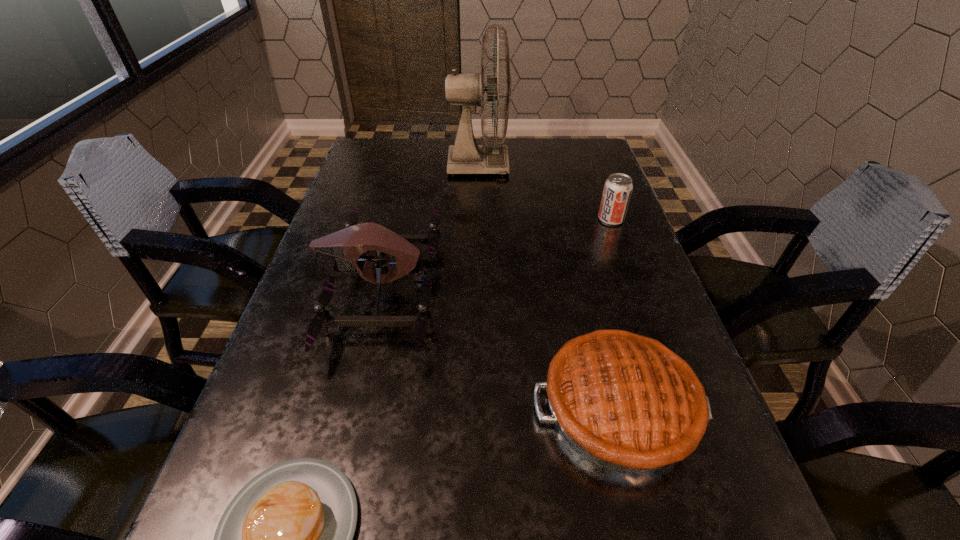
This screenshot has width=960, height=540. I want to click on fan, so click(464, 157).

Identify the location of the tallest object. (464, 157).

Where is `drone`? drone is located at coordinates (347, 245).

This screenshot has width=960, height=540. Find the location of `the second farthest object`. the second farthest object is located at coordinates (617, 191).

You are a GUI agent. You are given a task and a screenshot of the screen. Output one action in this format:
    pyautogui.click(x=<x>, y=<y>)
    Task: Click on the pie
    The width and height of the screenshot is (960, 540).
    Given the screenshot: What is the action you would take?
    pyautogui.click(x=628, y=403)

Find the location of a particular element. blank space located on the front-facing side of the tallest object is located at coordinates (605, 165).

Locate an element on the screen. This screenshot has height=540, width=960. vacant region located 0.380m on the front-facing side of the drone is located at coordinates (617, 289).

You are a GUI agent. You are given a task and a screenshot of the screen. Output one action in this format:
    pyautogui.click(x=<x>, y=<y>)
    Task: Click on the free spot located 0.150m on the left of the fourth nearest object
    
    Given the screenshot: What is the action you would take?
    pyautogui.click(x=539, y=219)

This screenshot has width=960, height=540. Find the location of `vacant area situated on the back of the pie`. vacant area situated on the back of the pie is located at coordinates coord(578,250).

Locate an element on the screen. object at the far edge is located at coordinates (464, 157).